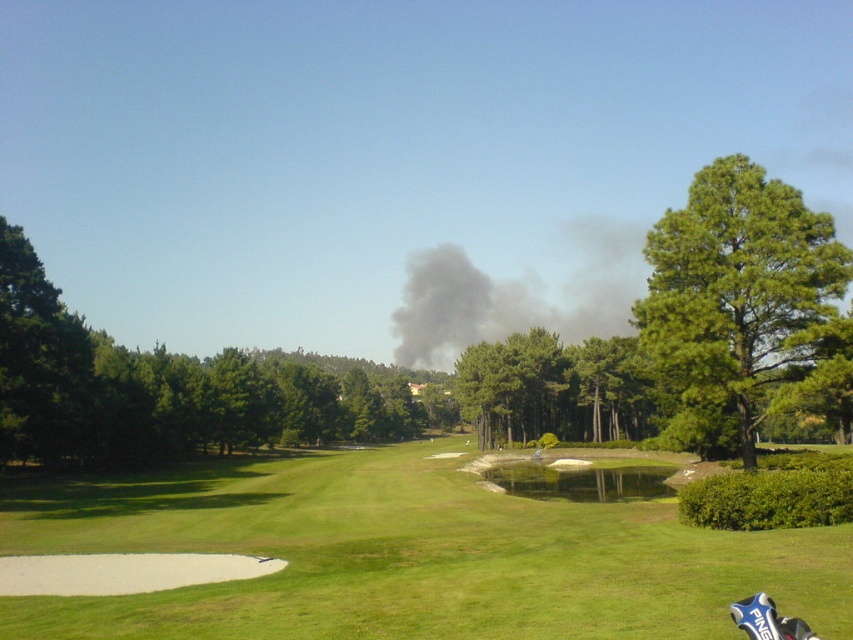
Is green grass at center below green needle-like tree at right?

Yes, green grass at center is below green needle-like tree at right.

Which is above, green grass at center or green needle-like tree at right?

green needle-like tree at right is higher up.

This screenshot has height=640, width=853. What are the coordinates of `green grass at center` in the screenshot? It's located at [x=408, y=556].

Is green needle-like tree at right taller than green leafy tree at left?

Indeed, green needle-like tree at right has a greater height compared to green leafy tree at left.

Is point (663, 342) closer to viewer compared to point (57, 324)?

Yes, point (663, 342) is closer to viewer.

Locate an element on the screen. green needle-like tree at right is located at coordinates (740, 291).

Identify the location of green needle-like tree at right. Image resolution: width=853 pixels, height=640 pixels. (740, 291).

Is point (315, 540) closer to viewer compared to point (47, 444)?

Yes, it is.

Locate an element on the screen. The image size is (853, 640). green grass at center is located at coordinates (408, 556).